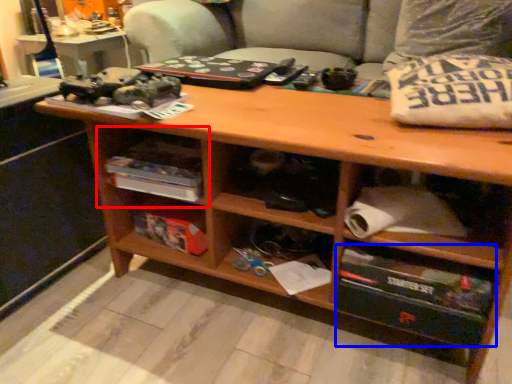
Question: Which object appears closest to the camera in this image, shelf (highlighted by a red box) or drawer (highlighted by a blue box)?

Choices:
 (A) shelf
 (B) drawer

Answer: (B)